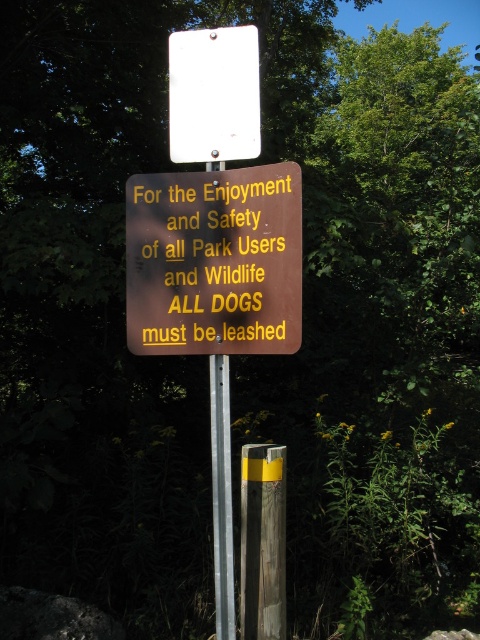
Question: Which of the following is the closest to the observer?

Choices:
 (A) (222, 481)
 (B) (180, 90)
 (C) (264, 445)
 (D) (222, 250)

Answer: (A)

Question: Can you confirm if brown matte sign at center is positioned above silver metallic pole at center?

Choices:
 (A) no
 (B) yes

Answer: (B)

Question: Is white paper at upper center thinner than silver metallic pole at center?

Choices:
 (A) yes
 (B) no

Answer: (B)

Question: Which object appears farthest from the camera in this image?

Choices:
 (A) yellow painted wood post at center
 (B) white paper at upper center
 (C) brown matte sign at center
 (D) silver metallic pole at center

Answer: (A)

Question: Can you confirm if white paper at upper center is positioned to the right of yellow painted wood post at center?

Choices:
 (A) yes
 (B) no

Answer: (B)

Question: Which of these objects is positioned closest to the brown matte sign at center?

Choices:
 (A) white paper at upper center
 (B) silver metallic pole at center
 (C) yellow painted wood post at center

Answer: (A)